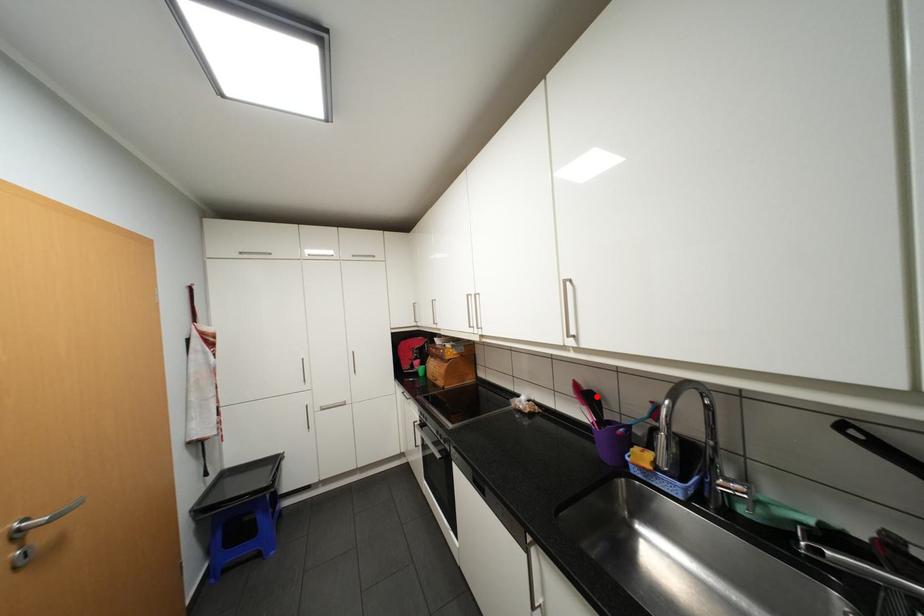
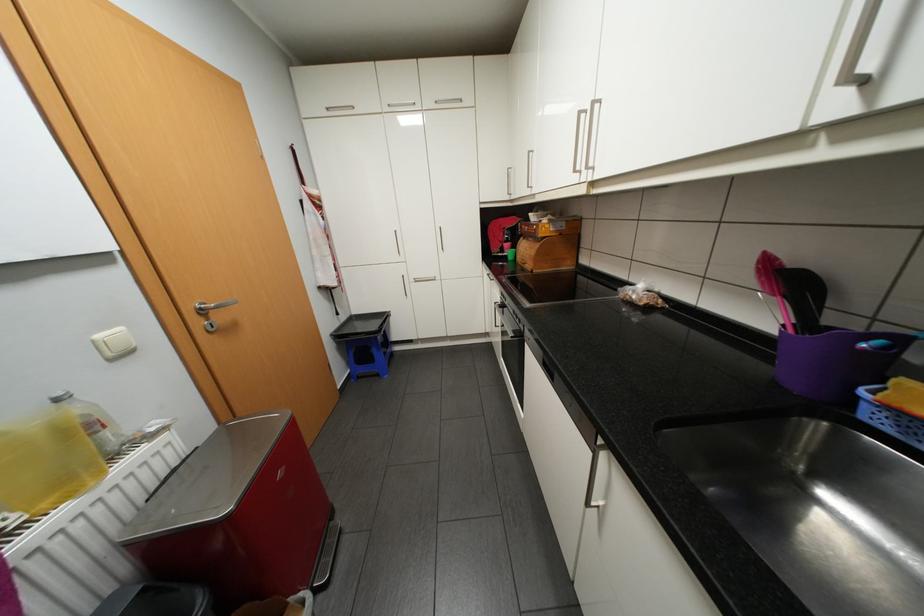
Locate, in the second image, the point that corresponds to the highlighted location in the first image.

(800, 283)